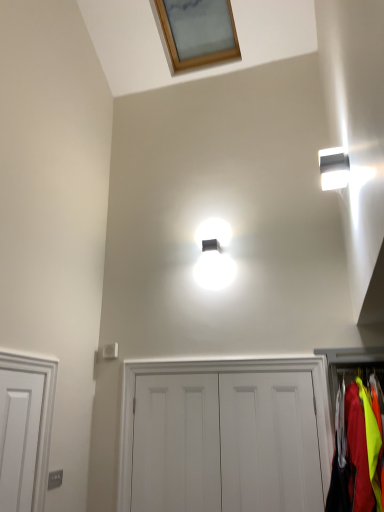
Question: Considering the relative positions of neon yellow fabric at right and white matte door at center, which is the 1th door in right-to-left order, in the image provided, is neon yellow fabric at right to the left or to the right of white matte door at center, which is the 1th door in right-to-left order,?

Choices:
 (A) left
 (B) right

Answer: (B)

Question: Is neon yellow fabric at right bigger or smaller than white matte door at center, which is the 1th door in right-to-left order?

Choices:
 (A) small
 (B) big

Answer: (B)

Question: Estimate the real-world distances between objects in this image. Which object is closer to the white matte door at center, the 1th door when ordered from left to right?

Choices:
 (A) white matte door at center, acting as the 2th door starting from the left
 (B) white glossy light fixture at upper right
 (C) wooden frame at upper center
 (D) white matte door at center, which is counted as the third door, starting from the left
 (E) neon yellow fabric at right

Answer: (A)

Question: Which of these objects is positioned closest to the white matte door at center, acting as the 2th door starting from the right?

Choices:
 (A) white matte door at center, which is the 1th door in right-to-left order
 (B) wooden frame at upper center
 (C) white glossy light fixture at upper right
 (D) white matte door at center, the 1th door when ordered from left to right
 (E) neon yellow fabric at right

Answer: (A)